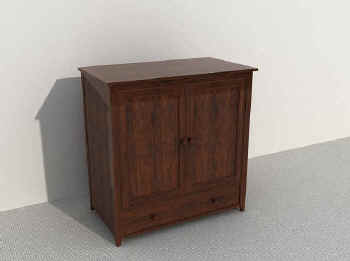
Where is `cabinet leg`? cabinet leg is located at coordinates (120, 242), (90, 209), (242, 208).